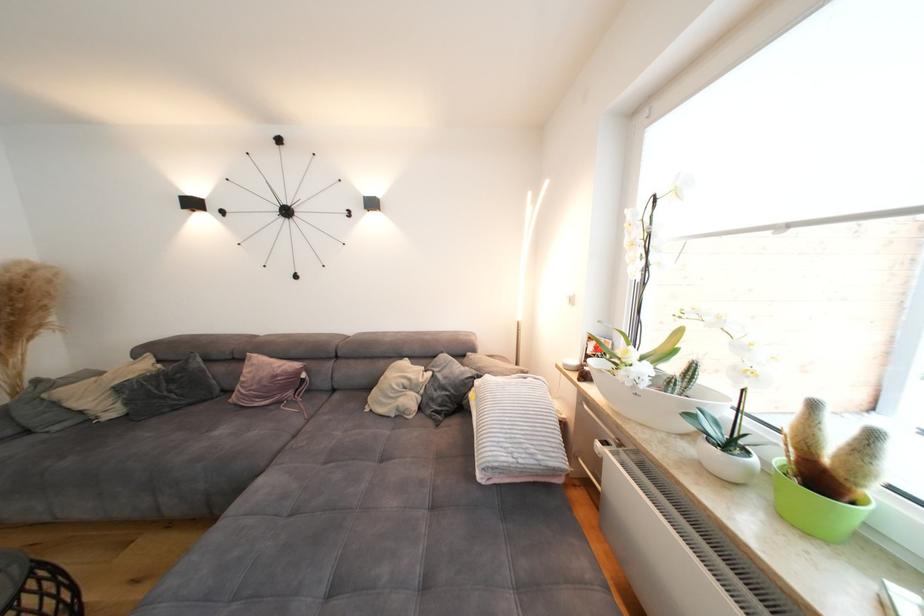
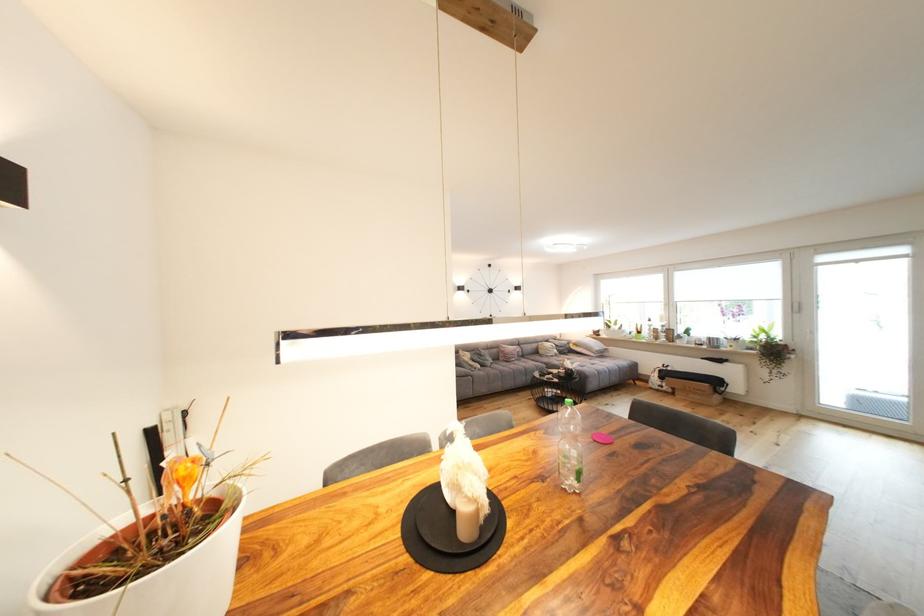
Where in the second image is the point corresponding to the point at 418,402 from the first image?

(563, 353)